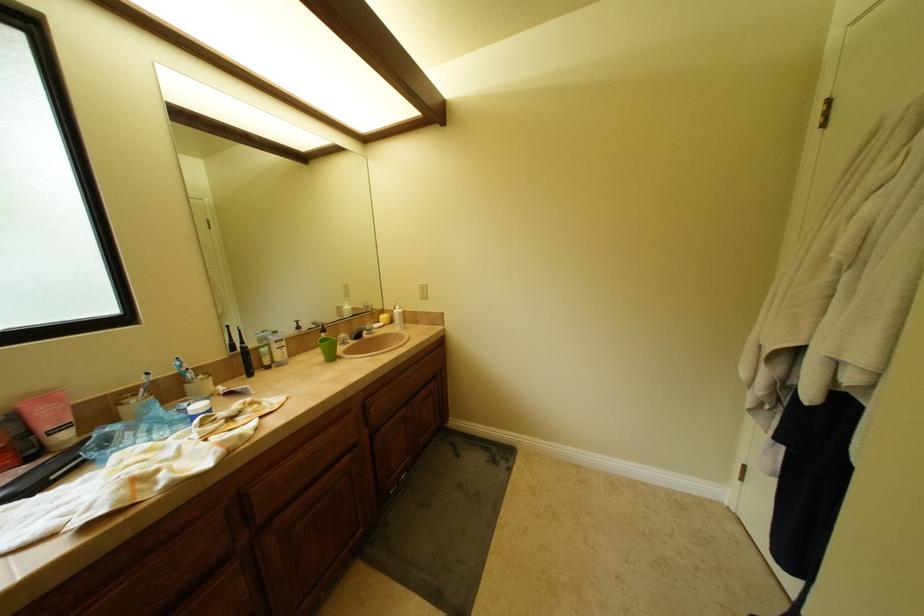
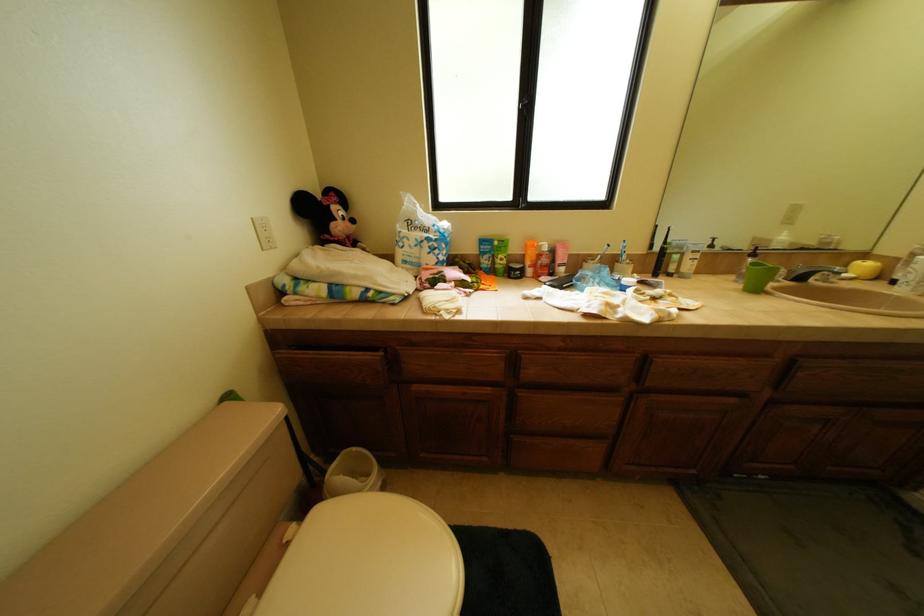
Based on the continuous images, in which direction is the camera rotating?

The rotation direction of the camera is left-down.